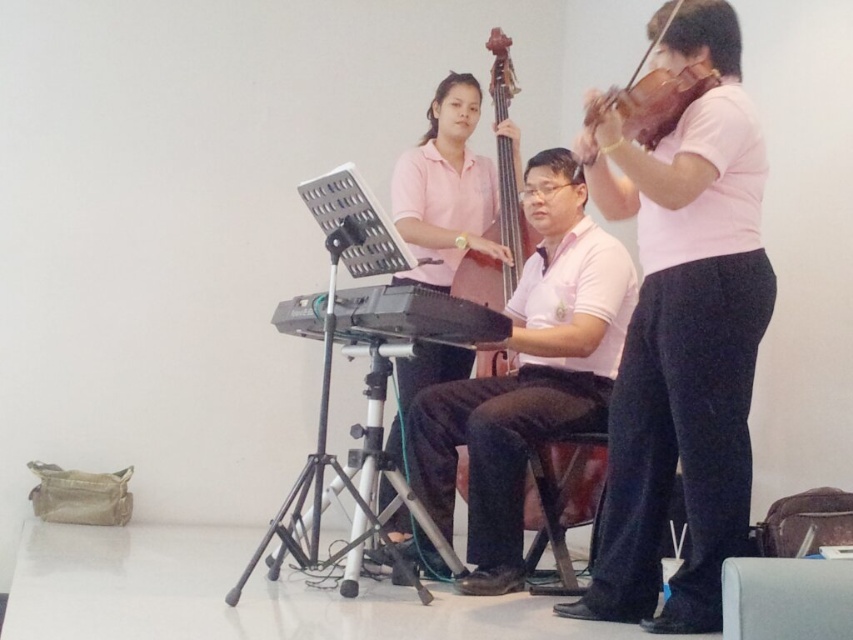
Question: Among these objects, which one is farthest from the camera?

Choices:
 (A) wooden violin at upper right
 (B) pink cotton shirt at upper right
 (C) pink matte shirt at center

Answer: (C)

Question: Estimate the real-world distances between objects in this image. Which object is farther from the pink cotton shirt at center?

Choices:
 (A) pink cotton shirt at upper right
 (B) matte black cello at center
 (C) wooden violin at upper right

Answer: (C)

Question: Is pink cotton shirt at center to the right of matte black cello at center from the viewer's perspective?

Choices:
 (A) yes
 (B) no

Answer: (B)

Question: Which point is farther to the camera?

Choices:
 (A) (724, 305)
 (B) (502, 307)
 (C) (648, 124)

Answer: (B)

Question: Is pink matte shirt at center closer to camera compared to wooden violin at upper right?

Choices:
 (A) no
 (B) yes

Answer: (A)

Question: Observing the image, what is the correct spatial positioning of pink cotton shirt at upper right in reference to wooden violin at upper right?

Choices:
 (A) below
 (B) above

Answer: (A)